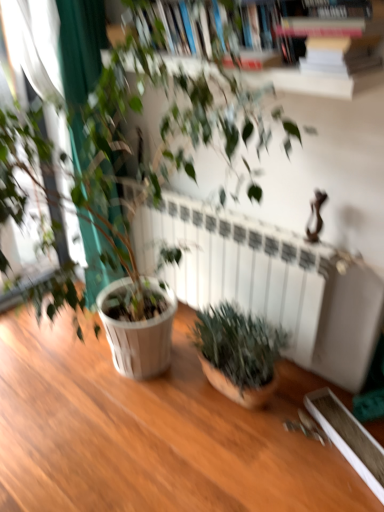
Identify the location of vacant space underneath green matte plant at center, acting as the second houseplant starting from the bottom (from a real-world perspective). The height and width of the screenshot is (512, 384). (101, 416).